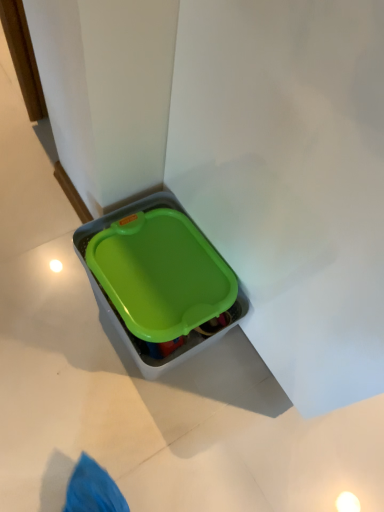
In order to face green plastic container at lower left, should I rotate leftwards or rightwards?

It's best to rotate left around 5.834 degrees.

This screenshot has height=512, width=384. Describe the element at coordinates (158, 277) in the screenshot. I see `green plastic container at lower left` at that location.

Image resolution: width=384 pixels, height=512 pixels. Find the location of `green plastic container at lower left`. green plastic container at lower left is located at coordinates (158, 277).

Where is `green plastic container at lower left`? Image resolution: width=384 pixels, height=512 pixels. green plastic container at lower left is located at coordinates (158, 277).